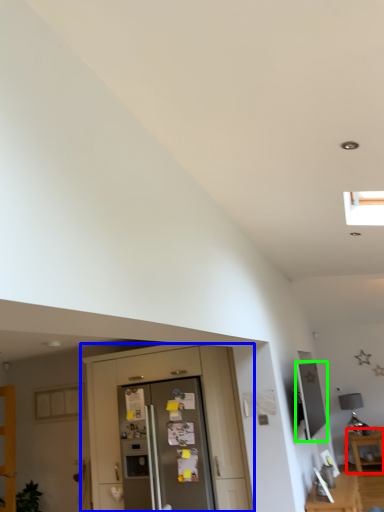
Question: Which is nearer to the table (highlighted by a red box)? dresser (highlighted by a blue box) or appliance (highlighted by a green box).

Choices:
 (A) dresser
 (B) appliance

Answer: (B)